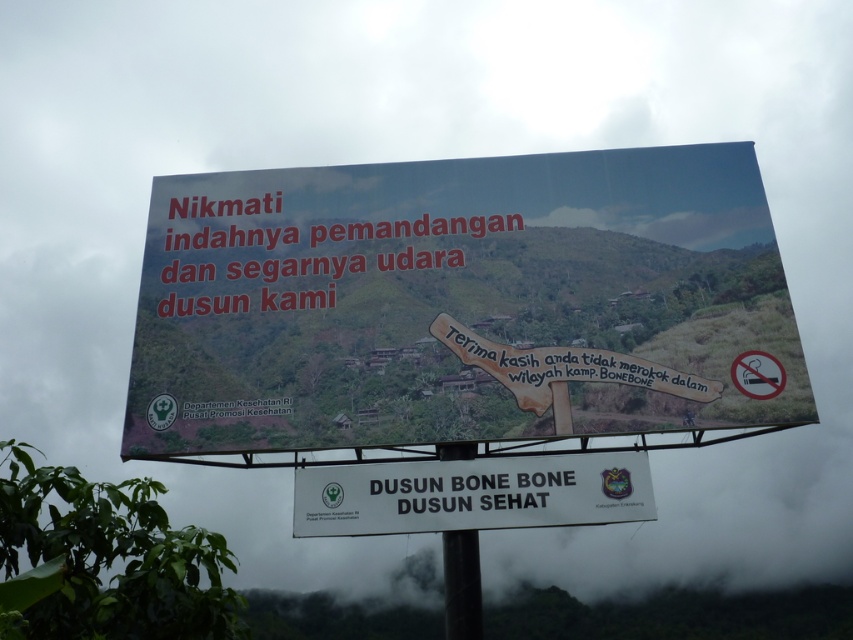
Which of these two, white plastic signboard at center or black metal pole at center, stands shorter?

With less height is white plastic signboard at center.

Can you confirm if white plastic signboard at center is bigger than black metal pole at center?

No.

Is point (404, 515) positioned in front of point (445, 561)?

Yes, point (404, 515) is in front of point (445, 561).

At what (x,y) coordinates should I click in order to perform the action: click on white plastic signboard at center. Please return your answer as a coordinate pair (x, y). Image resolution: width=853 pixels, height=640 pixels. Looking at the image, I should click on (473, 493).

Is point (287, 422) positioned before point (479, 579)?

No.

Describe the element at coordinates (461, 304) in the screenshot. I see `white plastic billboard at upper center` at that location.

Who is more forward, (373, 397) or (447, 608)?

Point (447, 608) is in front.

I want to click on white plastic billboard at upper center, so [x=461, y=304].

Who is shorter, white plastic billboard at upper center or white plastic signboard at center?

With less height is white plastic signboard at center.

Which of these two, white plastic billboard at upper center or white plastic signboard at center, stands taller?

white plastic billboard at upper center is taller.

Where is `white plastic billboard at upper center`? The width and height of the screenshot is (853, 640). white plastic billboard at upper center is located at coordinates (461, 304).